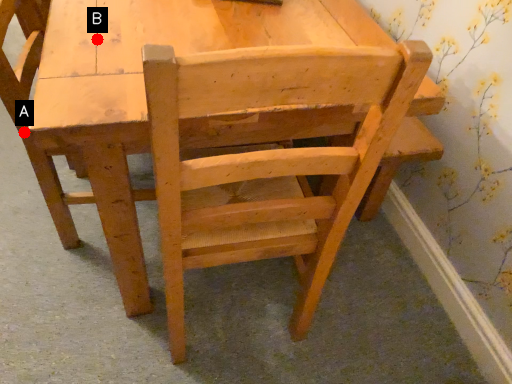
Question: Two points are circled on the image, labeled by A and B beside each circle. Which point appears closest to the camera in this image?

Choices:
 (A) A is closer
 (B) B is closer

Answer: (B)